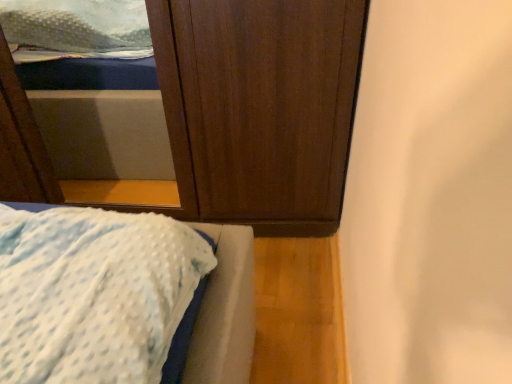
Looking at this image, measure the distance between point (250,133) and camera.

A distance of 4.30 feet exists between point (250,133) and camera.

The image size is (512, 384). Describe the element at coordinates (262, 107) in the screenshot. I see `dark wood dresser at upper center` at that location.

What is the approximate height of dark wood dresser at upper center?

It is 34.10 inches.

This screenshot has width=512, height=384. I want to click on dark wood dresser at upper center, so click(262, 107).

Locate an element on the screen. Image resolution: width=512 pixels, height=384 pixels. dark wood dresser at upper center is located at coordinates (262, 107).